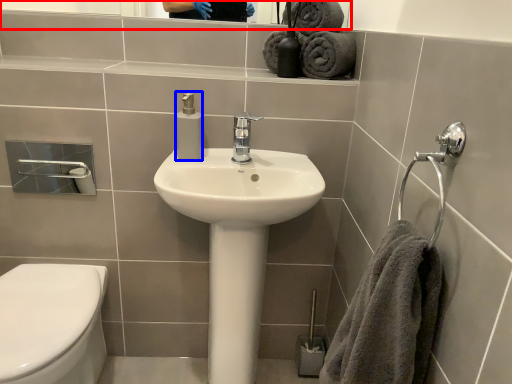
Question: Which object appears farthest to the camera in this image, mirror (highlighted by a red box) or soap dispenser (highlighted by a blue box)?

Choices:
 (A) mirror
 (B) soap dispenser

Answer: (A)